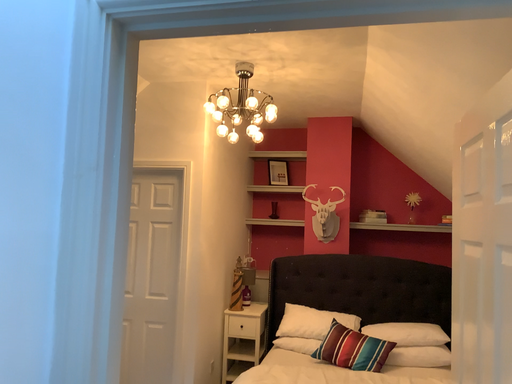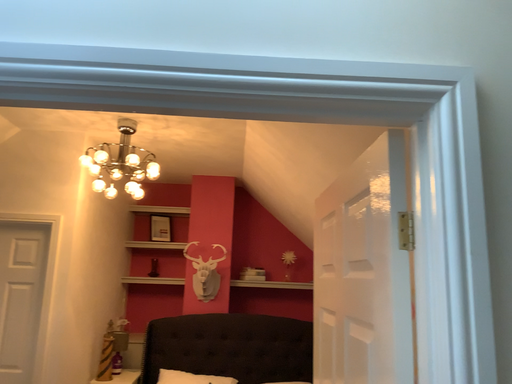
Question: How did the camera likely rotate when shooting the video?

Choices:
 (A) rotated right
 (B) rotated left

Answer: (A)